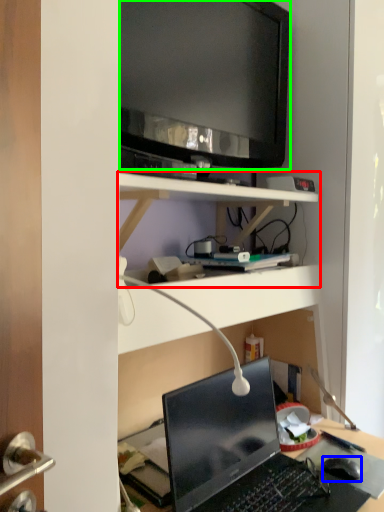
Question: Which is nearer to the shelf (highlighted by a red box)? computer mouse (highlighted by a blue box) or television (highlighted by a green box).

Choices:
 (A) computer mouse
 (B) television

Answer: (B)